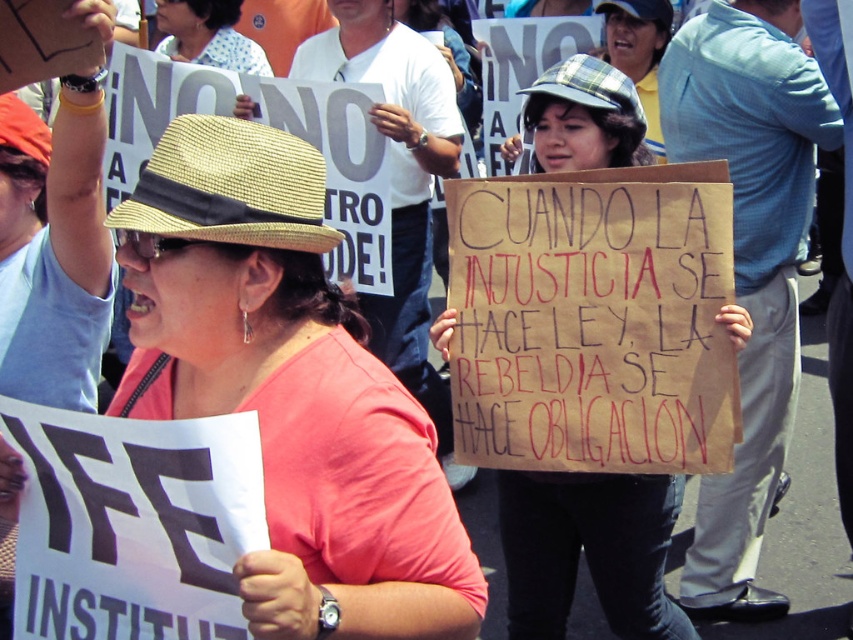
You are a photographer trying to capture a clear shot of the plaid fabric hat at center without the matte straw hat at center blocking it. Is this possible given their current positions?

The matte straw hat at center is positioned over the plaid fabric hat at center, so it is blocking the view. To capture the plaid fabric hat at center without obstruction, you would need to adjust the angle or move the matte straw hat at center out of the way.

You are a photographer at the protest scene. You need to capture a photo where both the matte straw hat at center and the plaid fabric hat at center are visible in the frame. Given their heights, which hat will appear taller in the photo?

The matte straw hat at center will appear taller in the photo because it is taller than the plaid fabric hat at center according to the description.

You are a photographer trying to capture a photo of the matte straw hat at center and the plaid fabric hat at center for a magazine spread. The magazine requires that the two hats must be at least 1.2 meters apart in the image to ensure clarity. Based on your current position, can you achieve this requirement?

The distance between the matte straw hat at center and the plaid fabric hat at center is 1.13 meters, which is less than the required 1.2 meters. Therefore, you cannot achieve the magazine requirement with your current position.